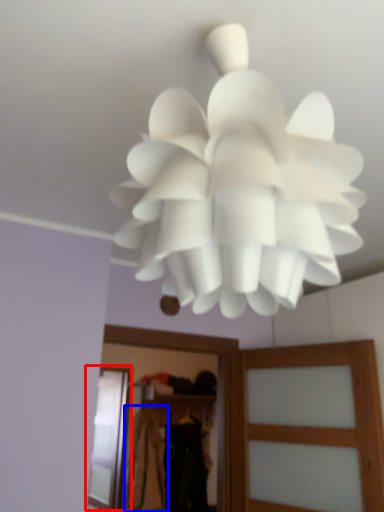
Question: Which point is further to the camera, screen door (highlighted by a red box) or clothing (highlighted by a blue box)?

Choices:
 (A) screen door
 (B) clothing

Answer: (B)